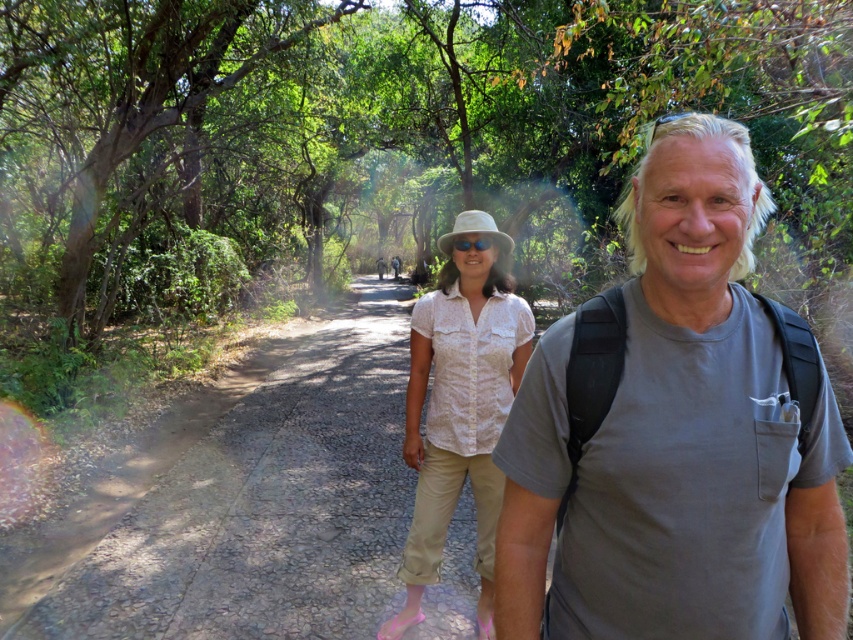
You are a hiker on a dirt road at center and want to take a photo of the green leafy tree at center. Which direction should you face to capture the tree in your shot?

The green leafy tree at center is to the left of the dirt road at center, so you should face to the left to capture the tree in your shot.